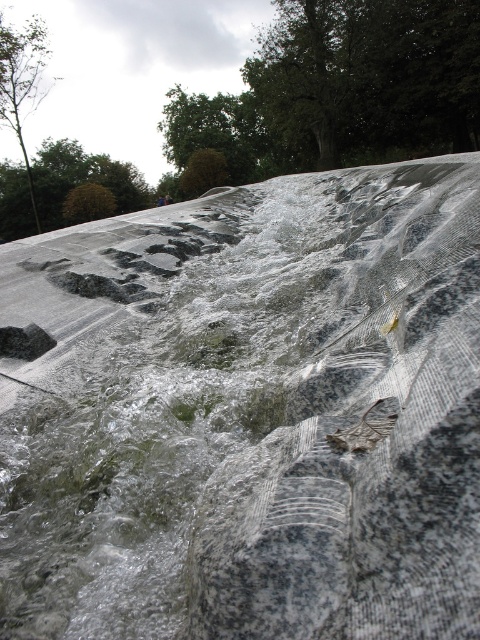
You are standing at the bottom of the inclined surface and looking upwards. Which green leafy tree is closer to the center of the surface between the green leafy tree at upper center and the green leafy tree at upper left?

The green leafy tree at upper center is closer to the center of the surface because it is positioned on the right side of the green leafy tree at upper left, placing it nearer to the central area.

You are standing in front of the water feature and notice two green leafy trees in the upper part of the scene. Which tree is nearer to you, the green leafy tree at upper center or the green leafy tree at upper left?

The green leafy tree at upper center is closer to the viewer than the green leafy tree at upper left, so the tree at upper center is nearer.